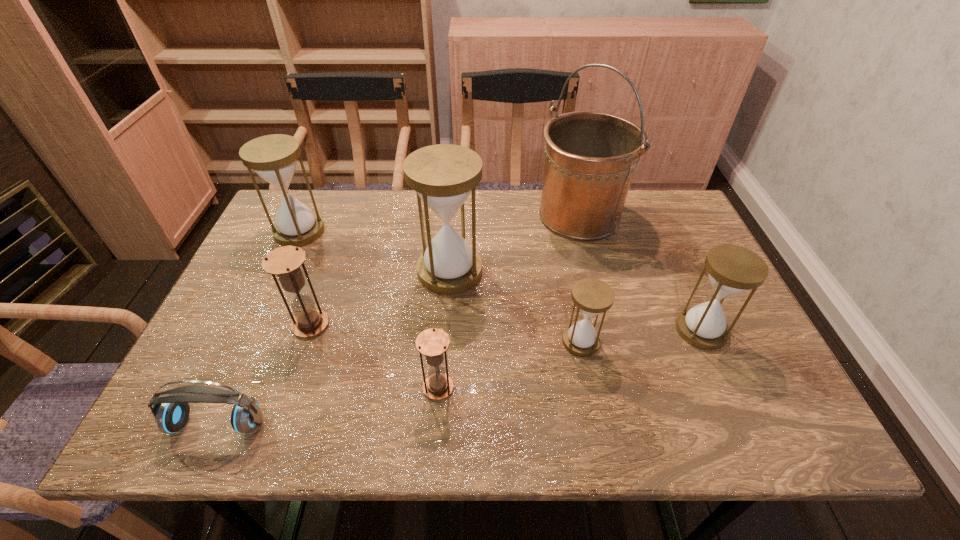
Locate an element on the screen. This screenshot has width=960, height=540. vacant space located on the right of the third white hourglass from left to right is located at coordinates (756, 341).

Where is `vacant area located on the front of the nearer brown hourglass`? The image size is (960, 540). vacant area located on the front of the nearer brown hourglass is located at coordinates (434, 440).

I want to click on bucket at the far edge, so click(590, 157).

Locate an element on the screen. hourglass located at the far edge is located at coordinates (273, 157).

Where is `hourglass present at the near edge`? This screenshot has width=960, height=540. hourglass present at the near edge is located at coordinates (433, 343).

This screenshot has width=960, height=540. Find the location of `headset positioned at the near edge`. headset positioned at the near edge is located at coordinates click(171, 416).

This screenshot has width=960, height=540. I want to click on hourglass positioned at the left edge, so [x=273, y=157].

Locate an element on the screen. headset present at the left edge is located at coordinates (171, 416).

Find the location of a particular element. This screenshot has width=960, height=540. object that is positioned at the right edge is located at coordinates (732, 270).

The width and height of the screenshot is (960, 540). I want to click on object situated at the far left corner, so click(273, 157).